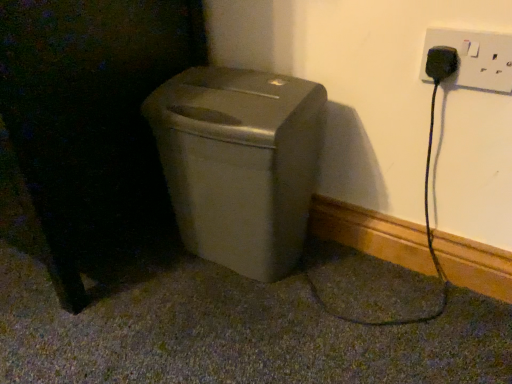
Question: Would you say black matte cat at left is inside or outside satin beige trash can at center?

Choices:
 (A) inside
 (B) outside

Answer: (B)

Question: In terms of height, does black matte cat at left look taller or shorter compared to satin beige trash can at center?

Choices:
 (A) short
 (B) tall

Answer: (B)

Question: Which of these objects is positioned closest to the black matte cat at left?

Choices:
 (A) satin beige trash can at center
 (B) white plastic plug at upper right

Answer: (A)

Question: Which object is the closest to the satin beige trash can at center?

Choices:
 (A) black matte cat at left
 (B) white plastic plug at upper right

Answer: (A)